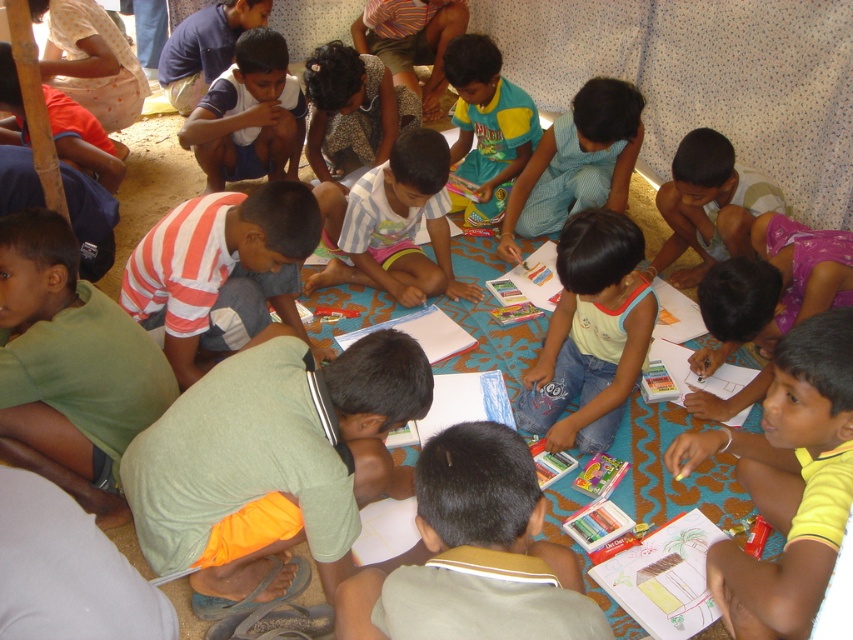
How much distance is there between green matte shirt at left and yellow cotton shirt at center?

green matte shirt at left is 3.76 feet away from yellow cotton shirt at center.

Looking at this image, is green matte shirt at left below yellow cotton shirt at center?

Correct, green matte shirt at left is located below yellow cotton shirt at center.

Measure the distance between point (x=20, y=355) and camera.

Point (x=20, y=355) and camera are 5.84 feet apart from each other.

Identify the location of green matte shirt at left. This screenshot has height=640, width=853. (68, 365).

From the picture: Is green matte shirt at left further to the viewer compared to striped fabric shirt at center?

No.

Is point (132, 360) positioned in front of point (355, 243)?

Yes.

Does point (83, 480) come farther from viewer compared to point (419, 218)?

No, it is not.

The image size is (853, 640). What are the coordinates of `green matte shirt at left` in the screenshot? It's located at pyautogui.click(x=68, y=365).

Can you confirm if green fabric shirt at lower left is taller than yellow cotton shirt at center?

No, green fabric shirt at lower left is not taller than yellow cotton shirt at center.

Who is positioned more to the left, green fabric shirt at lower left or yellow cotton shirt at center?

Positioned to the left is green fabric shirt at lower left.

Where is `green fabric shirt at lower left`? green fabric shirt at lower left is located at coordinates (273, 461).